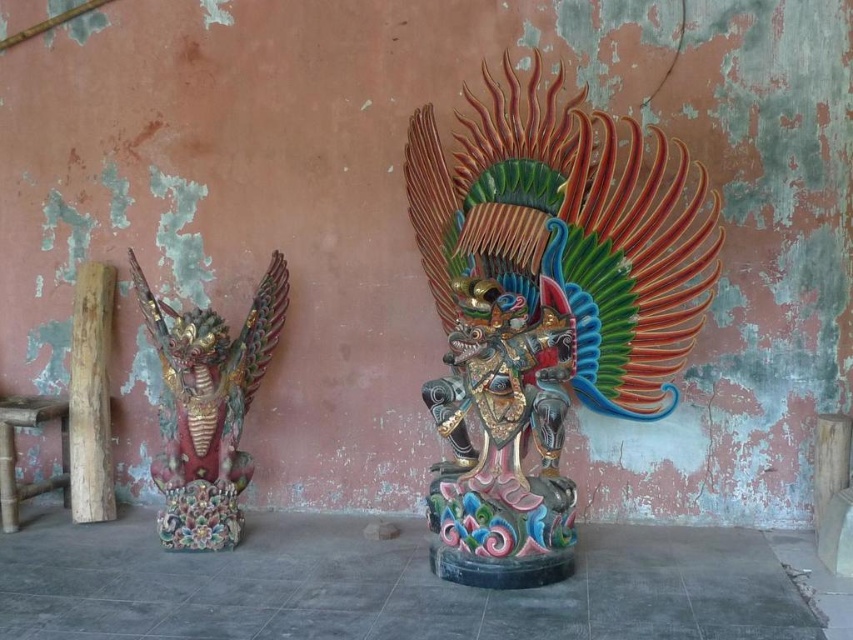
Question: Where is polychrome wood carving at left located in relation to bamboo stool at left in the image?

Choices:
 (A) below
 (B) above

Answer: (B)

Question: Which of these objects is positioned closest to the polychrome wood carving at left?

Choices:
 (A) multicolored painted statue at center
 (B) natural wood log at left

Answer: (B)

Question: Can you confirm if polychrome wood carving at left is bigger than bamboo stool at left?

Choices:
 (A) no
 (B) yes

Answer: (B)

Question: Is multicolored painted statue at center below bamboo stool at left?

Choices:
 (A) no
 (B) yes

Answer: (A)

Question: Which object is farther from the camera taking this photo?

Choices:
 (A) polychrome wood carving at left
 (B) multicolored painted statue at center

Answer: (A)

Question: Which object is positioned closest to the polychrome wood carving at left?

Choices:
 (A) multicolored painted statue at center
 (B) bamboo stool at left
 (C) natural wood log at left

Answer: (C)